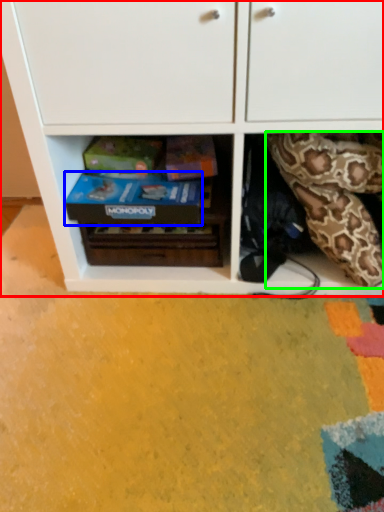
Question: Considering the real-world distances, which object is farthest from cabinetry (highlighted by a red box)? shoe box (highlighted by a blue box) or snake (highlighted by a green box)?

Choices:
 (A) shoe box
 (B) snake

Answer: (B)